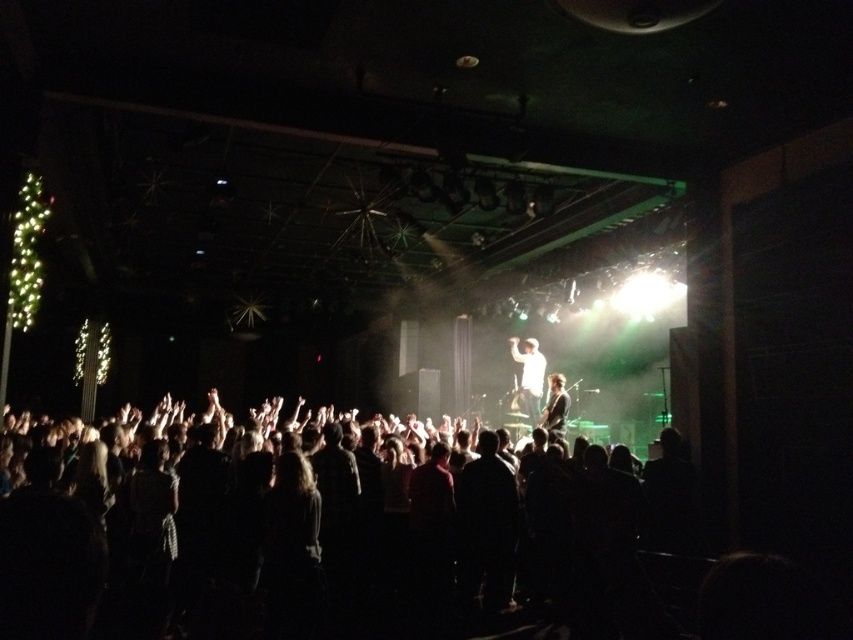
You are a photographer standing at the camera position. You want to take a photo of the dark clothing crowd at center. Given that your camera has a maximum focus range of 15 feet, will you be able to capture them clearly?

The dark clothing crowd at center and camera are 17.32 feet apart from each other. Since the distance exceeds the camera maximum focus range of 15 feet, you won

You are a photographer at the concert and want to capture a photo of the white matte shirt at center without the dark clothing crowd at center blocking it. Based on their positions, which side should you move to get a clear shot?

The dark clothing crowd at center is positioned on the left side of white matte shirt at center. To avoid the dark clothing crowd at center blocking the view, you should move to the right side of the white matte shirt at center.